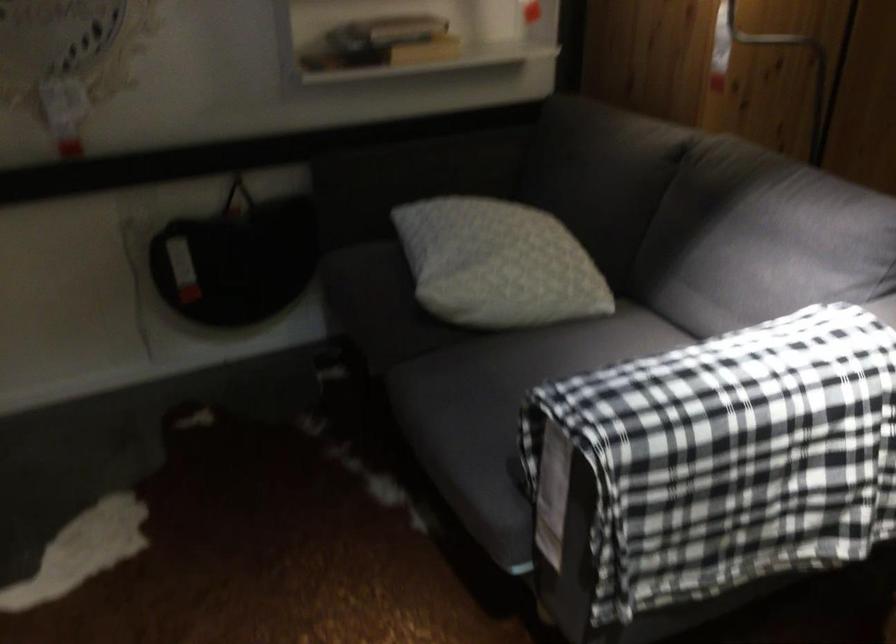
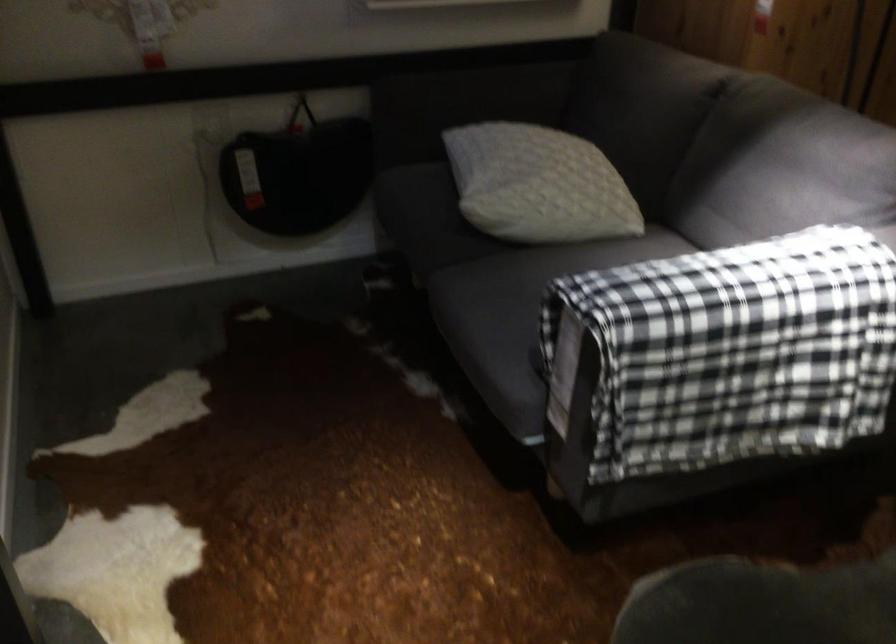
Find the pixel in the second image that matches the point at 475,393 in the first image.

(504, 292)